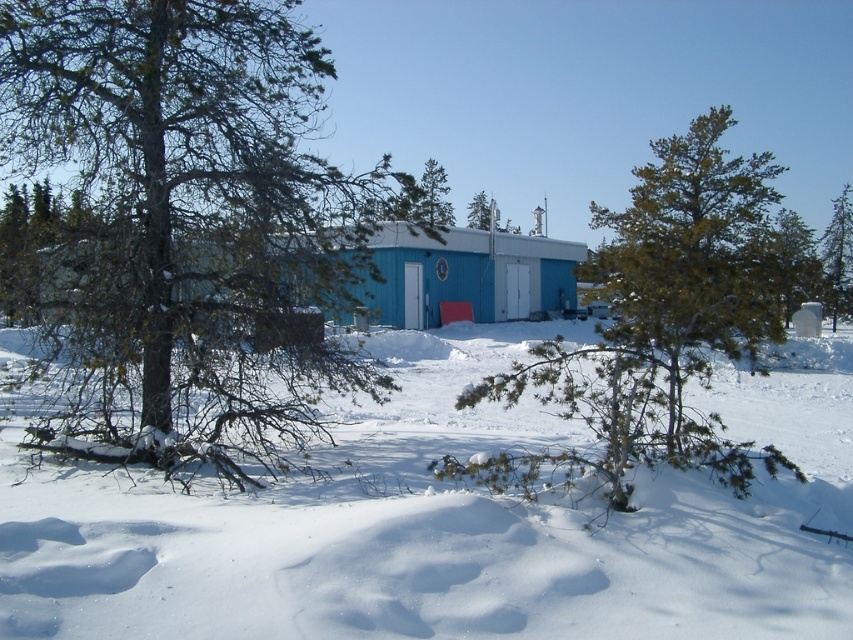
Question: Does white fluffy snow at center have a lesser width compared to green matte tree at upper right?

Choices:
 (A) yes
 (B) no

Answer: (B)

Question: Does blue matte building at center have a larger size compared to green textured tree at right?

Choices:
 (A) no
 (B) yes

Answer: (A)

Question: Which is nearer to the green matte tree at center?

Choices:
 (A) green textured tree at center
 (B) white fluffy snow at center

Answer: (A)

Question: Which point is closer to the camera?

Choices:
 (A) white fluffy snow at center
 (B) green matte tree at center
 (C) green textured tree at right

Answer: (A)

Question: Which object appears closest to the camera in this image?

Choices:
 (A) green matte tree at center
 (B) blue matte building at center

Answer: (B)

Question: Does green textured tree at right appear over green matte tree at center?

Choices:
 (A) yes
 (B) no

Answer: (B)